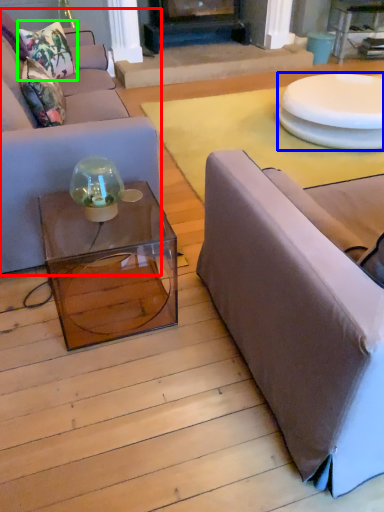
Question: Based on their relative distances, which object is farther from studio couch (highlighted by a red box)? Choose from round table (highlighted by a blue box) and pillow (highlighted by a green box).

Choices:
 (A) round table
 (B) pillow

Answer: (A)